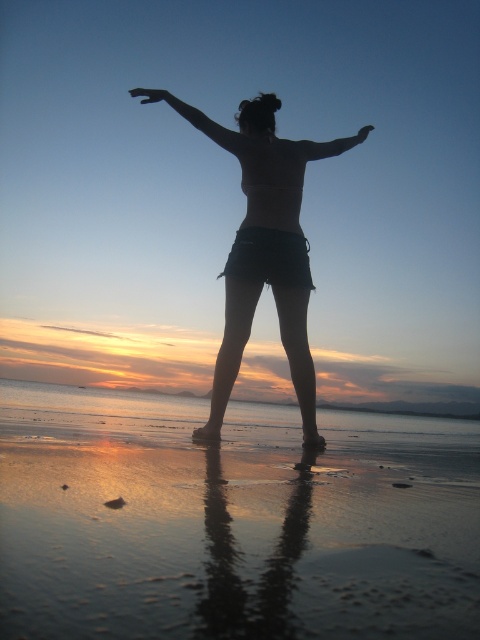
You are an artist analyzing the composition of the beach scene. You notice two arms in the image. Which of the two arms, the black matte arm at upper center or the matte black arm at upper center, takes up more visual space in the scene?

The matte black arm at upper center takes up more visual space than the black matte arm at upper center because the description states that the black matte arm occupies less space than the matte black arm.